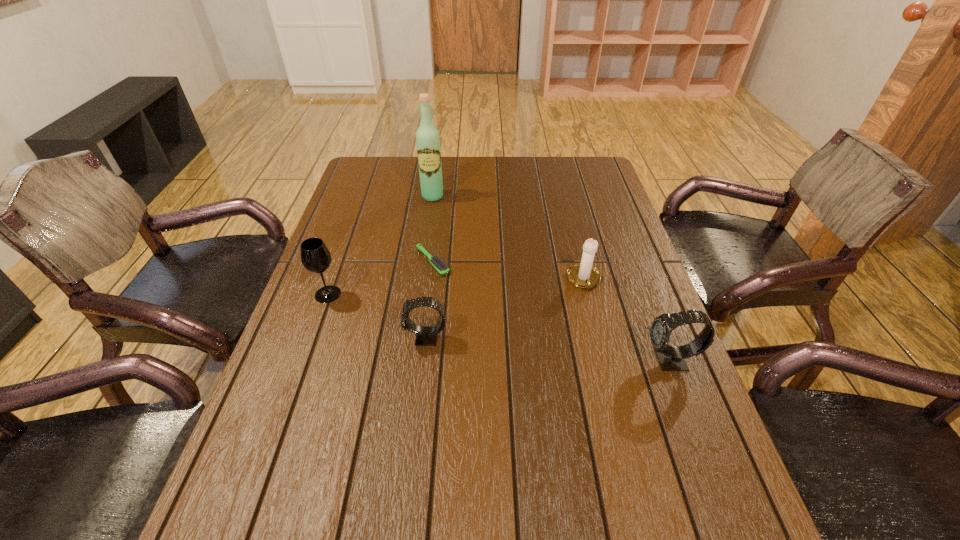
Identify the location of watch that is at the right edge. (671, 358).

Image resolution: width=960 pixels, height=540 pixels. Find the location of `candle holder that is at the right edge`. candle holder that is at the right edge is located at coordinates (584, 275).

The width and height of the screenshot is (960, 540). I want to click on free spot at the far edge of the desktop, so click(509, 183).

Find the location of a particular element. The height and width of the screenshot is (540, 960). vacant space at the near edge of the desktop is located at coordinates (475, 471).

In order to click on vacant region at the left edge of the desktop in this screenshot , I will do `click(355, 296)`.

Image resolution: width=960 pixels, height=540 pixels. Find the location of `free location at the right edge of the desktop`. free location at the right edge of the desktop is located at coordinates (643, 350).

Find the location of a particular element. This screenshot has width=960, height=540. vacant space at the near left corner of the desktop is located at coordinates (240, 491).

Locate an element on the screen. The height and width of the screenshot is (540, 960). vacant space at the far right corner of the desktop is located at coordinates (584, 165).

You are a GUI agent. You are given a task and a screenshot of the screen. Output one action in this format:
    pyautogui.click(x=<x>, y=<y>)
    Task: Click on the free space that is in between the wine bottle and the left watch
    
    Given the screenshot: What is the action you would take?
    pyautogui.click(x=429, y=267)

Find the location of `blank region between the wineglass and the tallest object`. blank region between the wineglass and the tallest object is located at coordinates (380, 245).